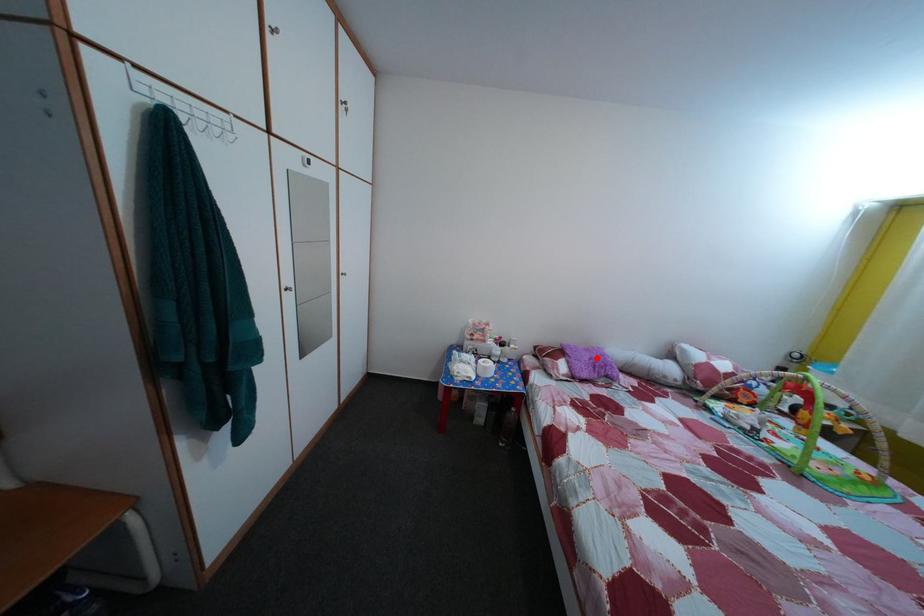
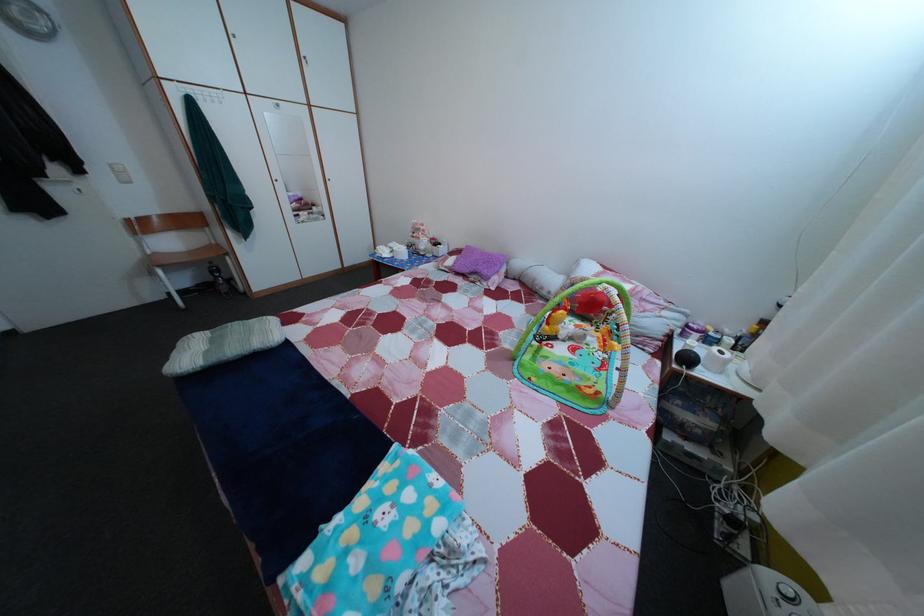
Locate, in the second image, the point that corresponds to the highlighted location in the first image.

(492, 261)